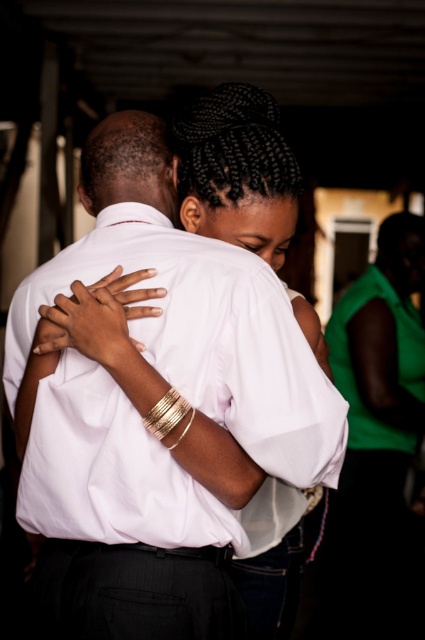
You are a photographer standing at the entrance of the room where the two people are embracing. You want to take a photo of both the white smooth shirt at center and the white matte dress at center without any obstruction. Given that your camera has a maximum focus range of 1.8 meters, will you be able to capture both subjects clearly in the same frame?

The white smooth shirt at center is 1.73 meters from the white matte dress at center. Since the distance between them is within the camera maximum focus range of 1.8 meters, the photographer can capture both subjects clearly in the same frame.

You are a photographer at a social event and want to capture a candid shot of the two people in the center. The white smooth shirt at center and the white matte dress at center are overlapping. Which clothing item is blocking the view of the other?

The white smooth shirt at center is in front of the white matte dress at center, so the white smooth shirt at center is blocking the view of the white matte dress at center.

You are standing in a room and see the white smooth shirt at center. If you want to shake hands with the person wearing it, can you reach them without moving closer?

The white smooth shirt at center and viewer are 1.20 meters apart from each other. The average arm length for an adult is about 0.7 meters. Since 1.20 meters is greater than 0.7 meters, you cannot reach them without moving closer.